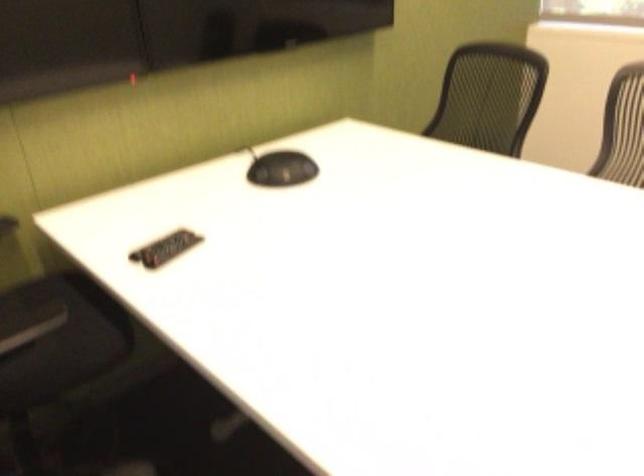
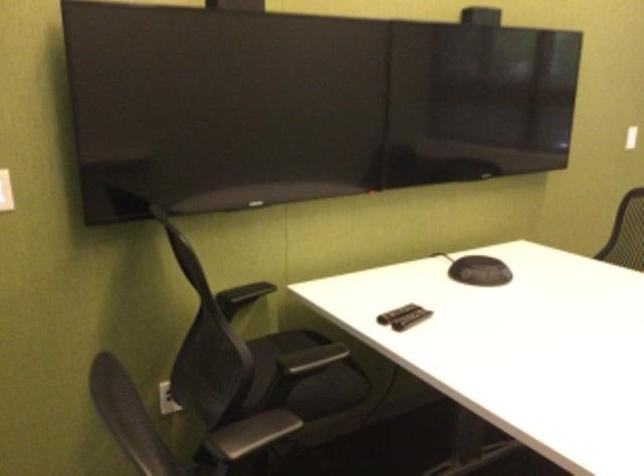
Locate, in the second image, the point that corresponds to the point at 149,244 in the first image.

(395, 313)